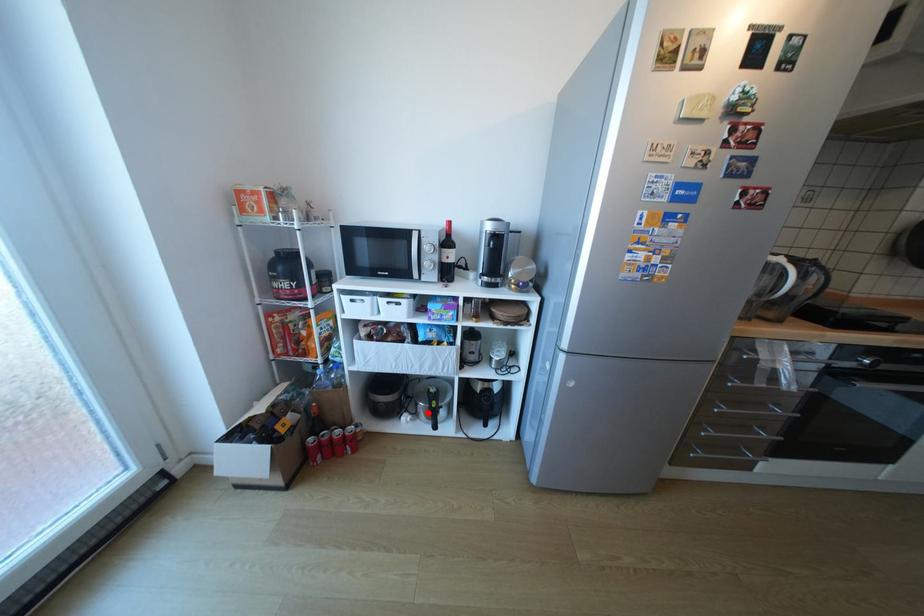
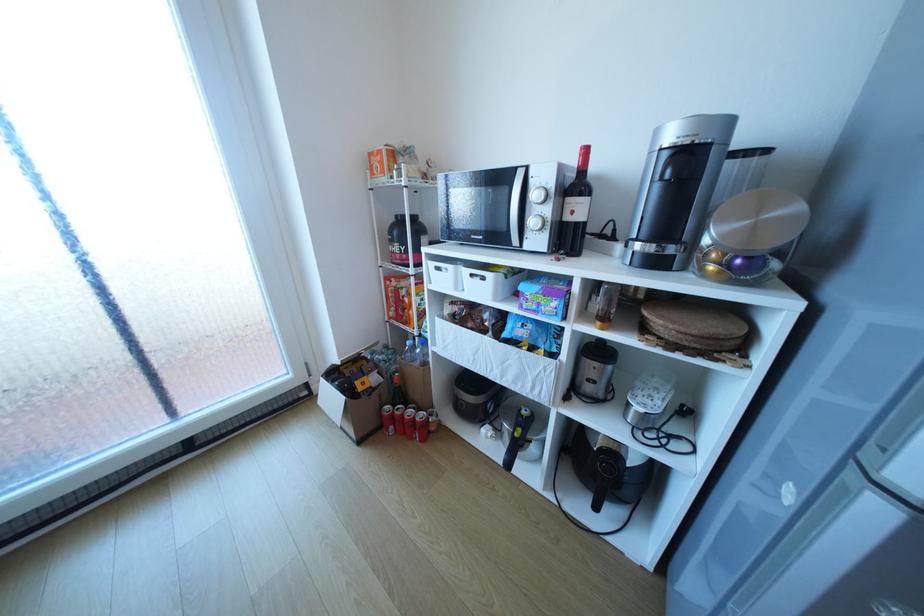
Question: I am providing you with two images of the same scene from different viewpoints. Given a red point in image1, look at the same physical point in image2. Is it:

Choices:
 (A) Closer to the viewpoint
 (B) Farther from the viewpoint

Answer: (A)